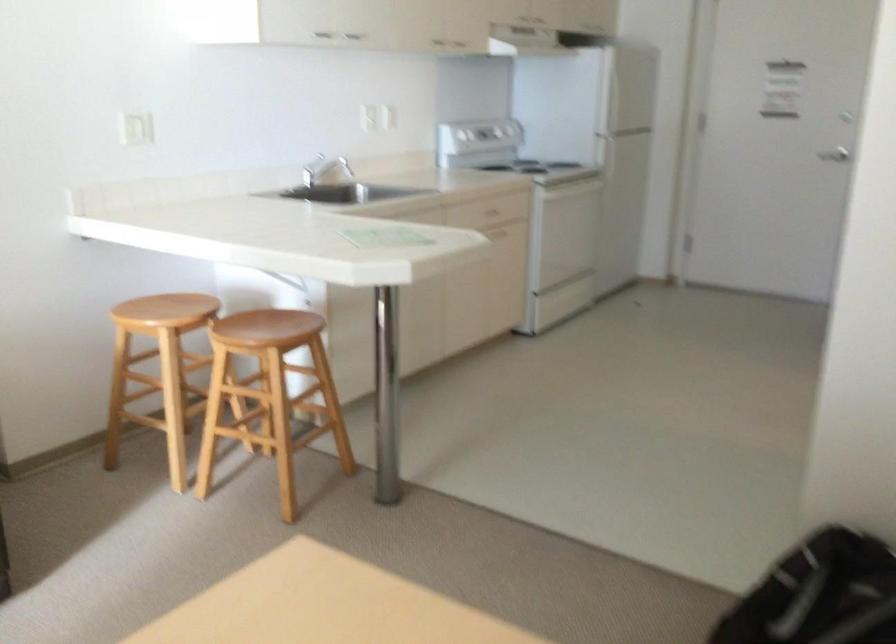
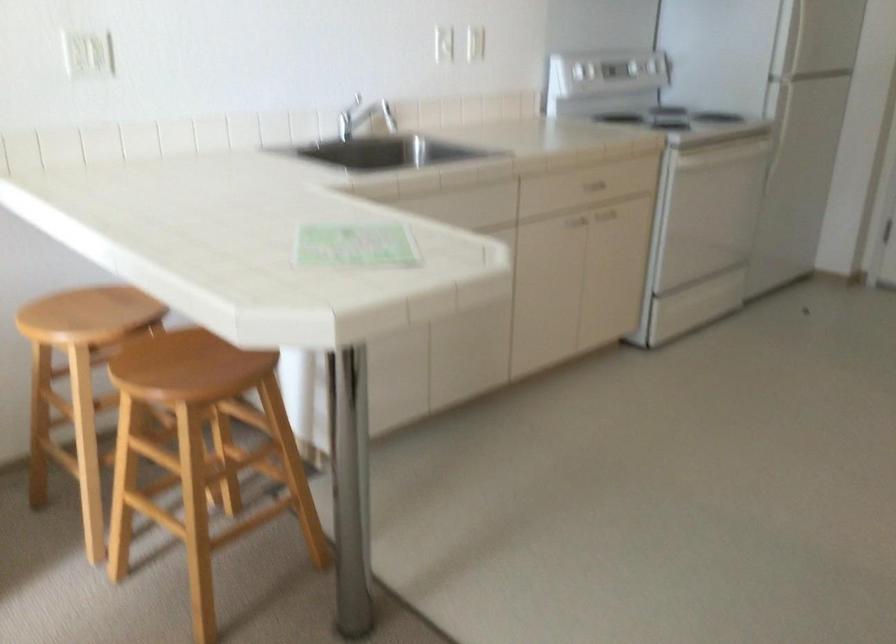
Locate, in the second image, the point that corresponds to pixel 159 308 in the first image.

(82, 315)